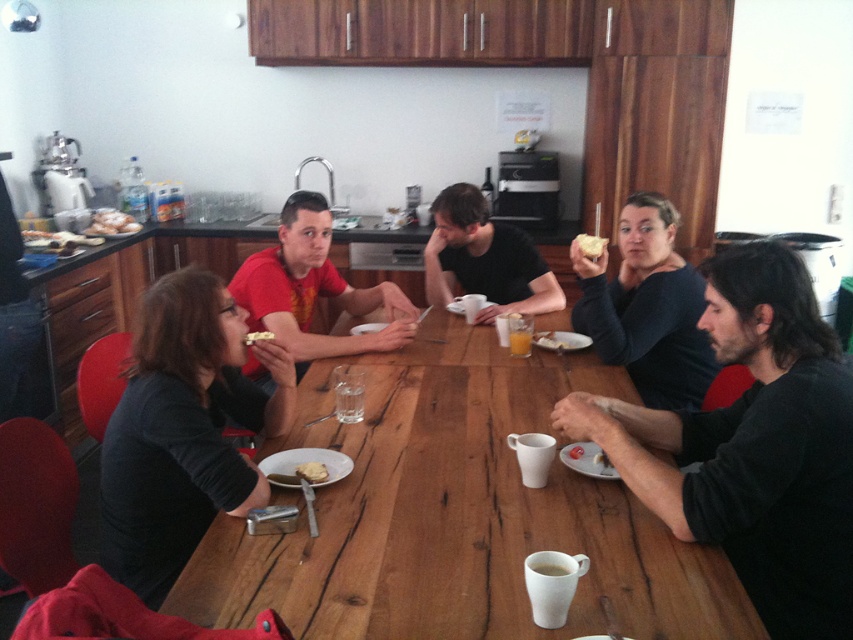
Is black matte shirt at upper right shorter than yellow cake at center?

No.

Who is more forward, (735, 534) or (317, 468)?

Positioned in front is point (735, 534).

This screenshot has height=640, width=853. Identify the location of black matte shirt at upper right. (753, 445).

Identify the location of black matte shirt at upper right. This screenshot has height=640, width=853. (753, 445).

Which of these two, white crumbly bread at upper center or orange juice at table center, stands taller?

white crumbly bread at upper center is taller.

Between point (596, 246) and point (511, 339), which one is positioned behind?

Point (511, 339)

Locate an element on the screen. This screenshot has height=640, width=853. white crumbly bread at upper center is located at coordinates point(590,244).

Is point (163, 310) more distant than point (489, 317)?

No, (163, 310) is in front of (489, 317).

Is dark gray sweater at left wider than matte black shirt at center?

In fact, dark gray sweater at left might be narrower than matte black shirt at center.

This screenshot has height=640, width=853. In order to click on dark gray sweater at left in this screenshot , I will do `click(183, 429)`.

Where is `dark gray sweater at left`? The width and height of the screenshot is (853, 640). dark gray sweater at left is located at coordinates (183, 429).